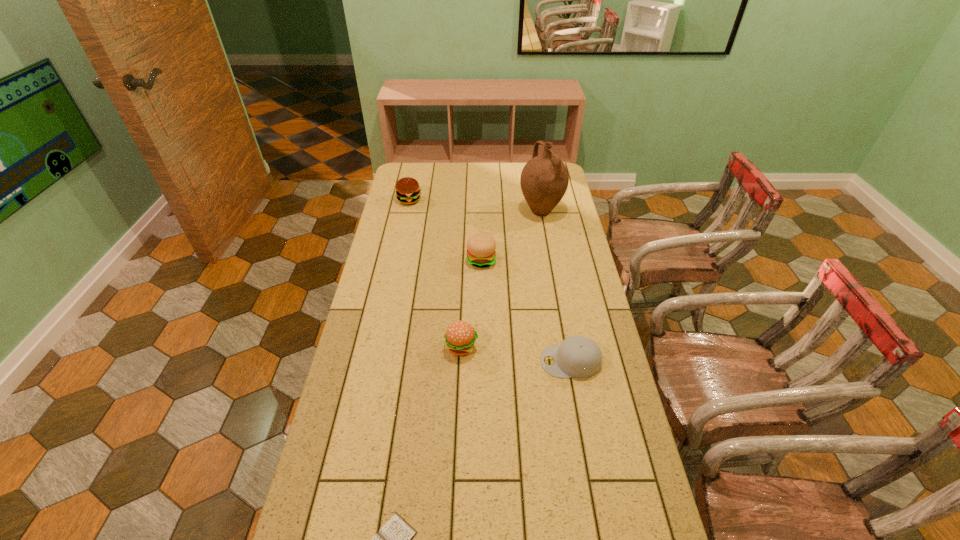
I want to click on vacant space positioned 0.370m on the front-facing side of the second shortest object, so click(x=423, y=361).

The width and height of the screenshot is (960, 540). I want to click on free space located on the front-facing side of the second shortest object, so click(437, 361).

Image resolution: width=960 pixels, height=540 pixels. What are the coordinates of `object that is at the left edge` in the screenshot? It's located at (408, 192).

Image resolution: width=960 pixels, height=540 pixels. I want to click on pitcher located in the right edge section of the desktop, so click(544, 179).

Image resolution: width=960 pixels, height=540 pixels. I want to click on cap that is at the right edge, so click(x=577, y=356).

Locate an element on the screen. The height and width of the screenshot is (540, 960). vacant space at the far edge of the desktop is located at coordinates (468, 177).

Find the location of a particular element. vacant space at the left edge of the desktop is located at coordinates (381, 278).

I want to click on vacant space at the right edge of the desktop, so pos(542,229).

The height and width of the screenshot is (540, 960). I want to click on free space between the pitcher and the farthest hamburger, so click(x=475, y=206).

Where is `free space between the tallest object and the fourth nearest object`? free space between the tallest object and the fourth nearest object is located at coordinates (511, 235).